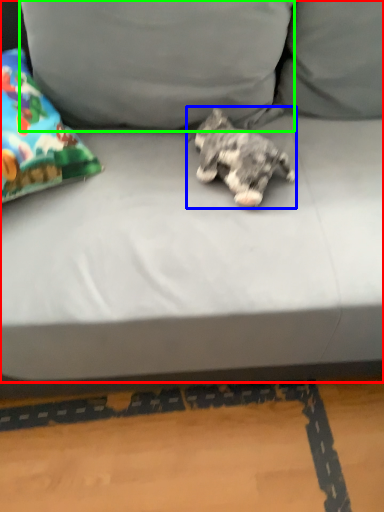
Question: Estimate the real-world distances between objects in this image. Which object is farther from studio couch (highlighted by a red box), dog (highlighted by a blue box) or pillow (highlighted by a green box)?

Choices:
 (A) dog
 (B) pillow

Answer: (A)